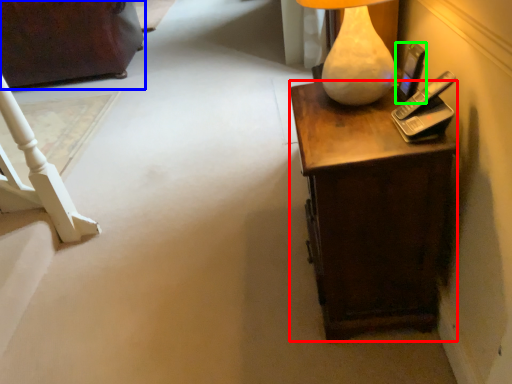
Question: Based on their relative distances, which object is nearer to desk (highlighted by a red box)? Choose from furniture (highlighted by a blue box) and mobile phone (highlighted by a green box).

Choices:
 (A) furniture
 (B) mobile phone

Answer: (B)